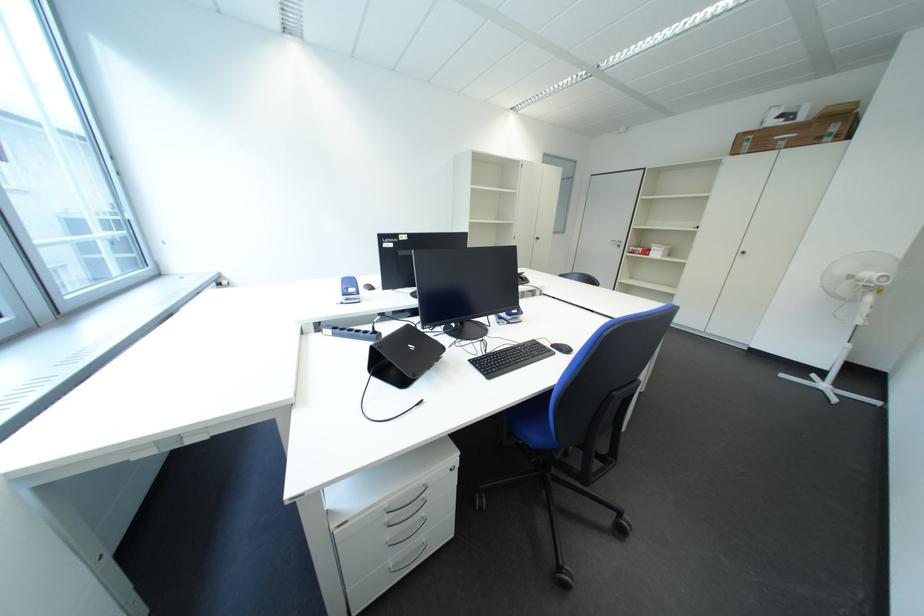
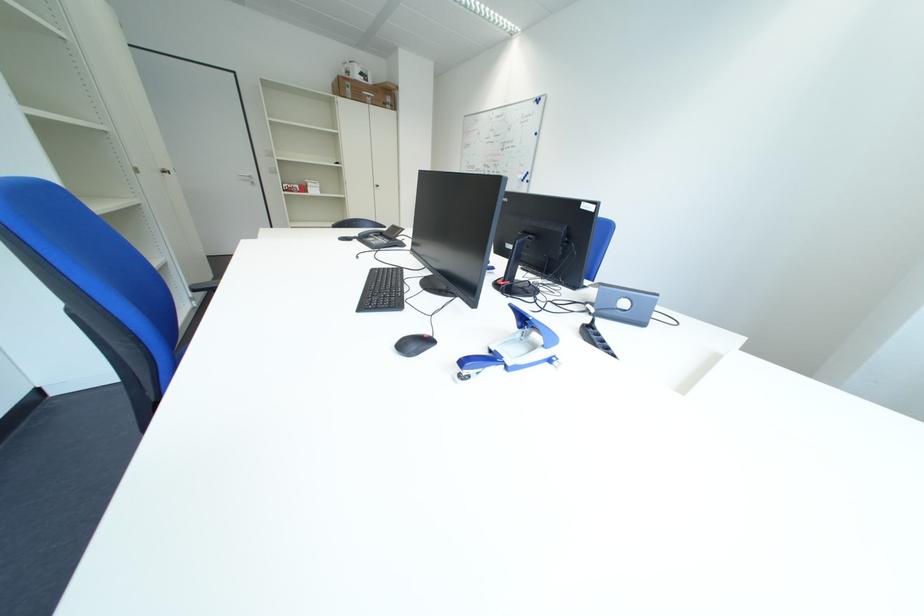
Locate, in the second image, the point that corresponds to point (813, 120) in the first image.

(383, 84)